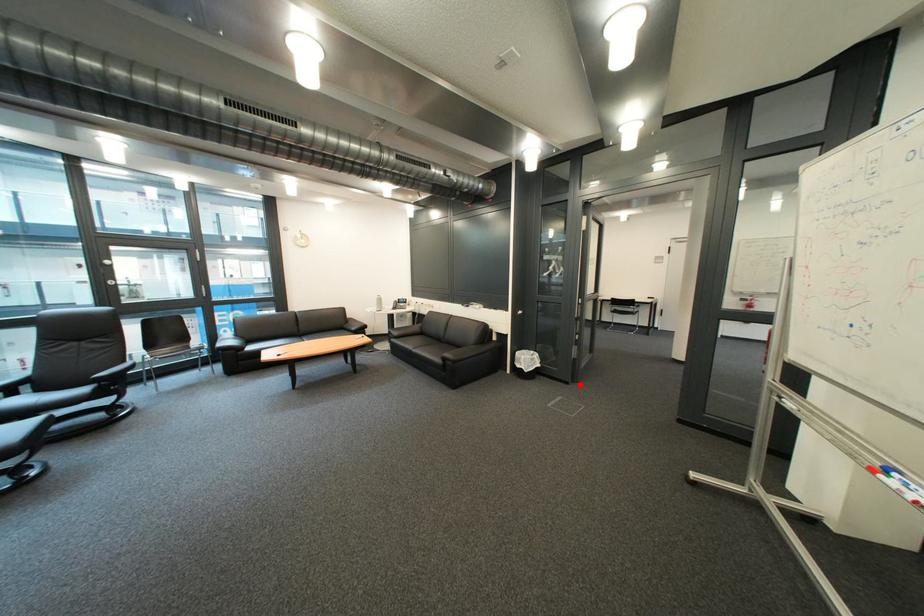
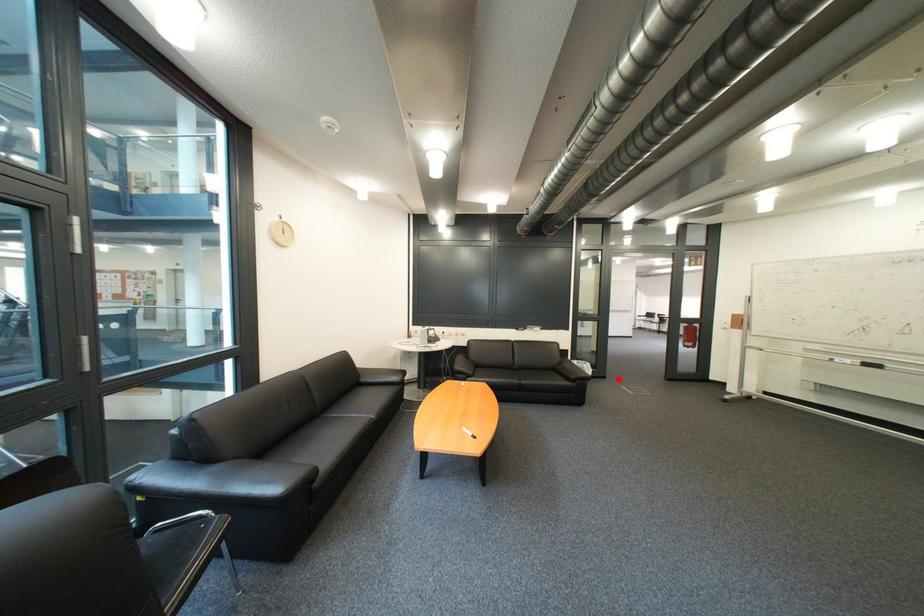
I am providing you with two images of the same scene from different viewpoints. A red point is marked on the first image and another point is marked on the second image. Does the point marked in image1 correspond to the same location as the one in image2?

Yes